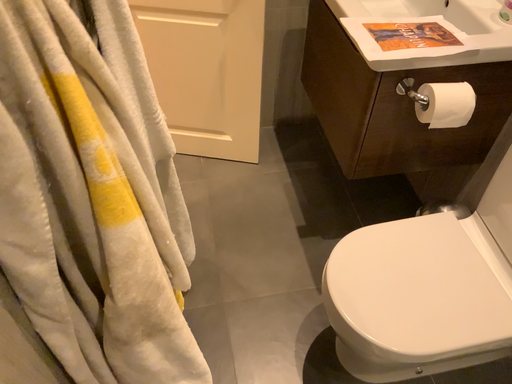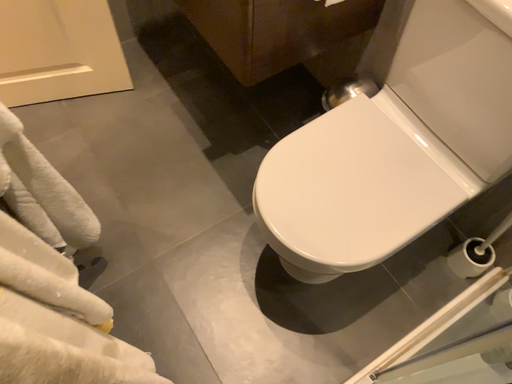
Question: Which way did the camera rotate in the video?

Choices:
 (A) rotated downward
 (B) rotated upward

Answer: (A)